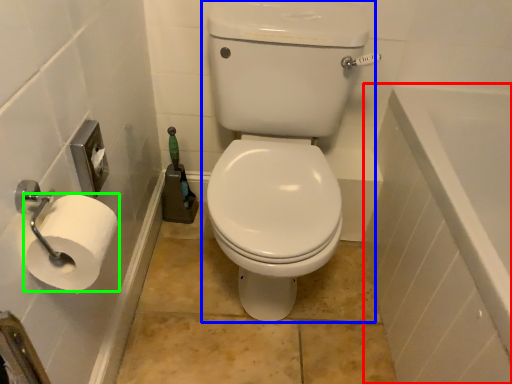
Question: Considering the real-world distances, which object is farthest from bath (highlighted by a red box)? sit (highlighted by a blue box) or toilet paper (highlighted by a green box)?

Choices:
 (A) sit
 (B) toilet paper

Answer: (B)